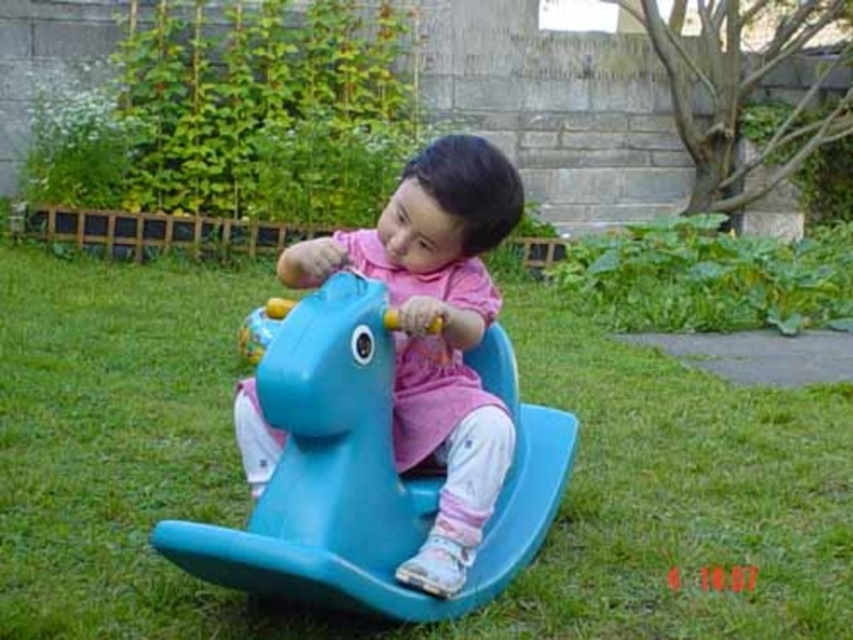
Question: Can you confirm if blue plastic horse at center is thinner than matte plastic horse at center?

Choices:
 (A) no
 (B) yes

Answer: (A)

Question: Can you confirm if blue plastic horse at center is bigger than matte plastic horse at center?

Choices:
 (A) no
 (B) yes

Answer: (B)

Question: Which of the following is the closest to the observer?

Choices:
 (A) (495, 173)
 (B) (265, 497)

Answer: (B)

Question: Can you confirm if blue plastic horse at center is positioned below matte plastic horse at center?

Choices:
 (A) no
 (B) yes

Answer: (B)